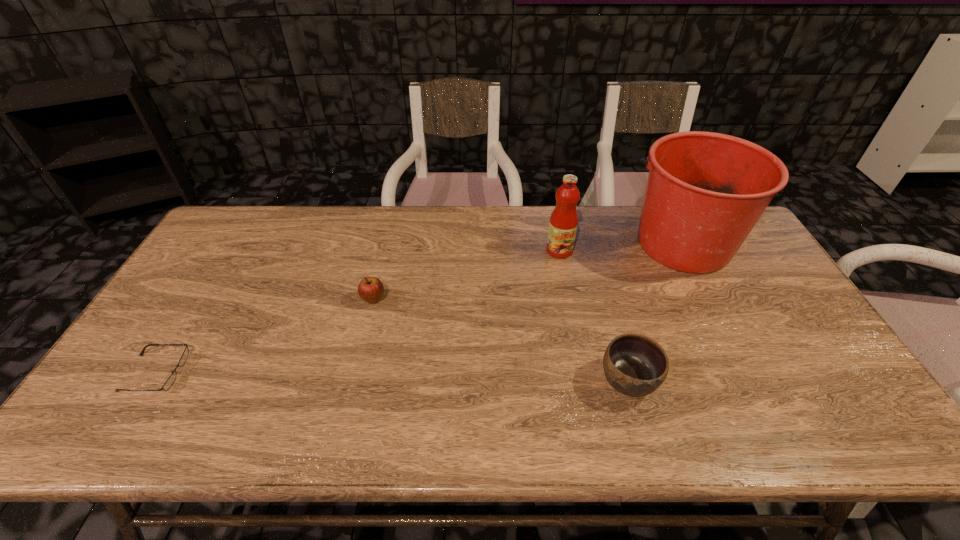
At what (x,y) coordinates should I click in order to perform the action: click on free region located on the right of the fourth object from right to left. Please return your answer as a coordinate pair (x, y). Image resolution: width=960 pixels, height=540 pixels. Looking at the image, I should click on pyautogui.click(x=459, y=300).

I want to click on free spot located on the front-facing side of the leftmost object, so click(307, 373).

In order to click on bucket present at the far edge in this screenshot , I will do `click(705, 191)`.

Image resolution: width=960 pixels, height=540 pixels. What are the coordinates of `fruit juice that is positioned at the far edge` in the screenshot? It's located at (563, 223).

You are a GUI agent. You are given a task and a screenshot of the screen. Output one action in this format:
    pyautogui.click(x=<x>, y=<y>)
    Task: Click on the object located at the left edge
    
    Given the screenshot: What is the action you would take?
    pyautogui.click(x=182, y=361)

Image resolution: width=960 pixels, height=540 pixels. I want to click on object positioned at the right edge, so click(x=705, y=191).

This screenshot has height=540, width=960. I want to click on object located at the far right corner, so click(705, 191).

Image resolution: width=960 pixels, height=540 pixels. I want to click on vacant space at the far edge of the desktop, so click(542, 224).

In the image, there is a desktop. Where is `vacant space at the near edge`? This screenshot has width=960, height=540. vacant space at the near edge is located at coordinates (289, 414).

Identify the location of vacant region at the left edge of the desktop. (178, 320).